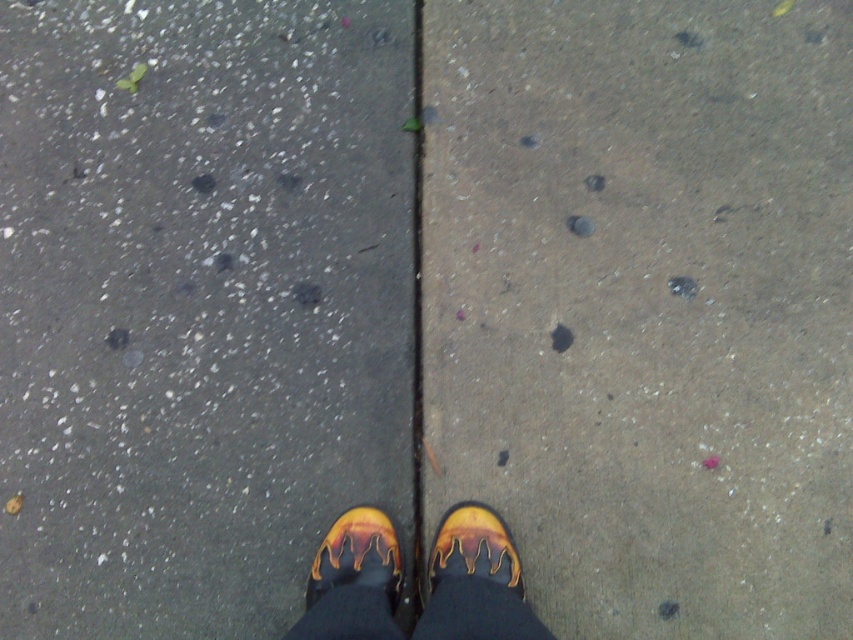
Question: Is concrete at center to the left of yellow rubber shoe at center from the viewer's perspective?

Choices:
 (A) yes
 (B) no

Answer: (B)

Question: Does smooth asphalt at left come behind yellow rubber shoe at center?

Choices:
 (A) yes
 (B) no

Answer: (A)

Question: Estimate the real-world distances between objects in this image. Which object is farther from the concrete at center?

Choices:
 (A) yellow rubber shoe at lower center
 (B) yellow rubber boots at center
 (C) yellow rubber shoe at center
 (D) black rubber crack at center

Answer: (C)

Question: Which of the following is the closest to the observer?

Choices:
 (A) (433, 621)
 (B) (479, 552)
 (C) (418, 224)

Answer: (A)

Question: Which of the following is the farthest from the observer?

Choices:
 (A) (480, 548)
 (B) (693, 180)
 (C) (397, 204)
 (D) (334, 572)

Answer: (C)

Question: In this image, where is smooth asphalt at left located relative to yellow rubber shoe at center?

Choices:
 (A) below
 (B) above

Answer: (B)